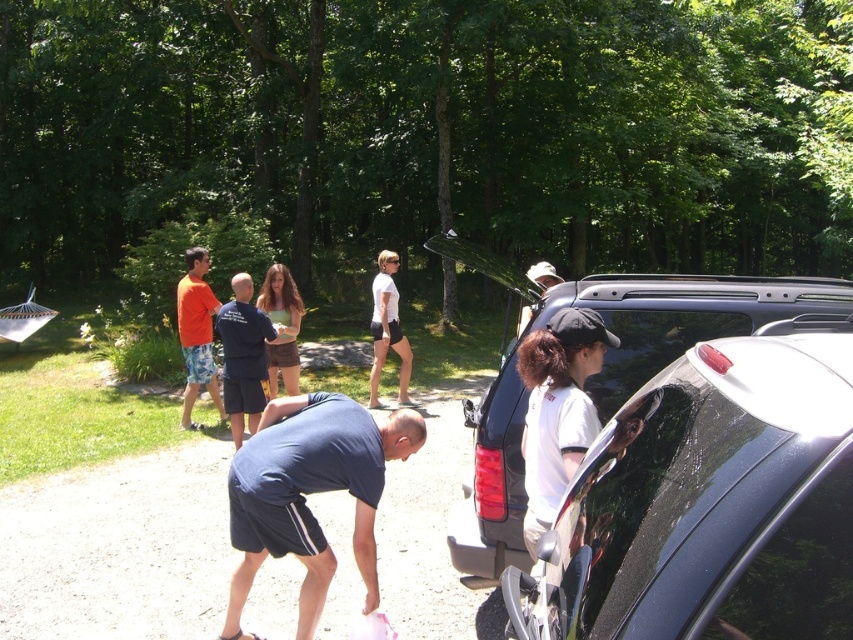
Question: Which of these objects is positioned closest to the dark blue shirt at center?

Choices:
 (A) matte green shirt at center
 (B) dark blue fabric shirt at lower center
 (C) white matte shorts at center
 (D) shiny black car at lower right

Answer: (A)

Question: Which point is farther from the camera taking this photo?

Choices:
 (A) (x=537, y=605)
 (B) (x=401, y=372)
 (C) (x=189, y=394)

Answer: (B)

Question: Does shiny black car at lower right lie behind orange cotton shirt at left?

Choices:
 (A) yes
 (B) no

Answer: (B)

Question: Among these points, which one is farthest from the camera?

Choices:
 (A) pyautogui.click(x=769, y=353)
 (B) pyautogui.click(x=386, y=330)
 (C) pyautogui.click(x=569, y=451)
 (D) pyautogui.click(x=286, y=324)

Answer: (B)

Question: In this image, where is orange cotton shirt at left located relative to white matte shorts at center?

Choices:
 (A) left
 (B) right

Answer: (A)

Question: Does shiny black car at lower right have a smaller size compared to white matte shirt at right?

Choices:
 (A) yes
 (B) no

Answer: (B)